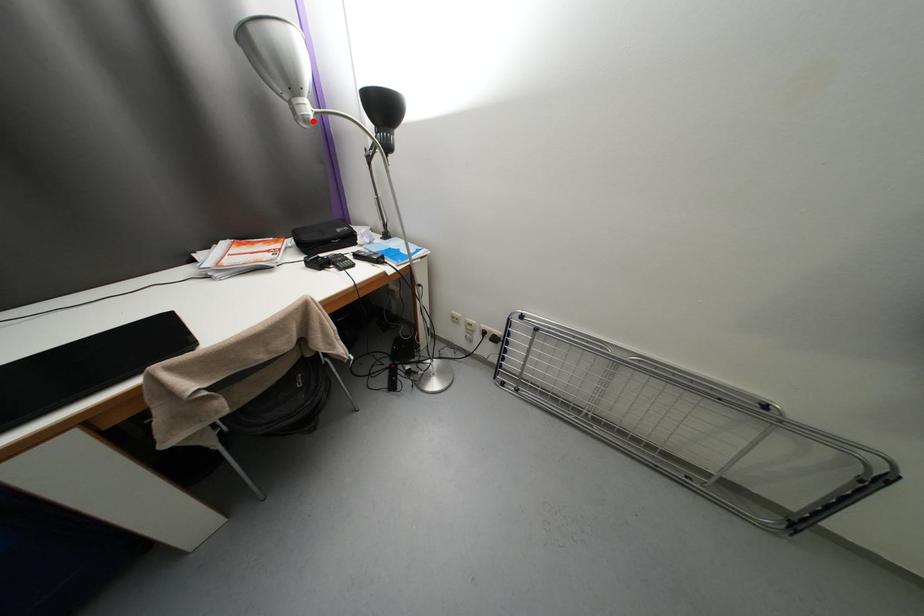
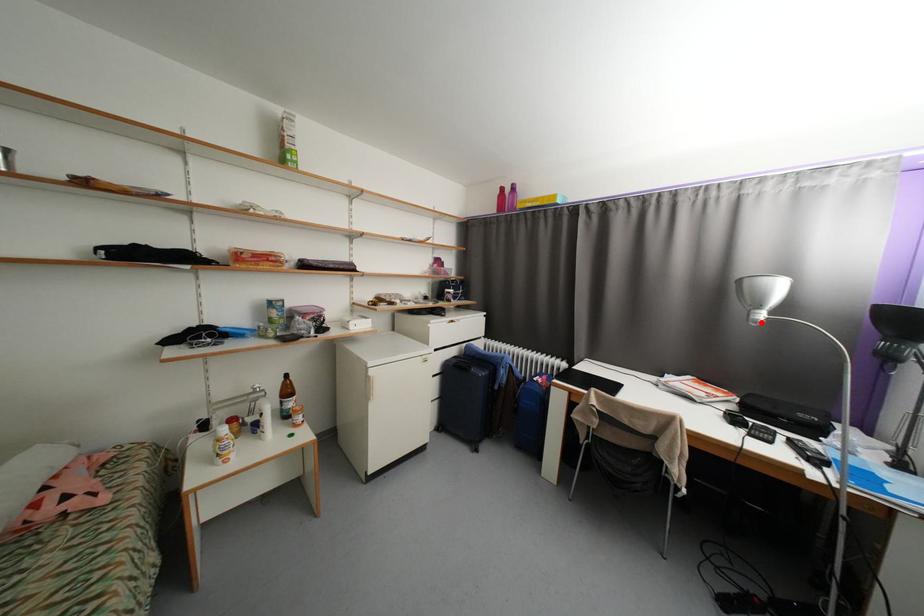
Consider the image. I am providing you with two images of the same scene from different viewpoints. A red point is marked on the first image and another point is marked on the second image. Are the points marked in image1 and image2 representing the same 3D position?

Yes